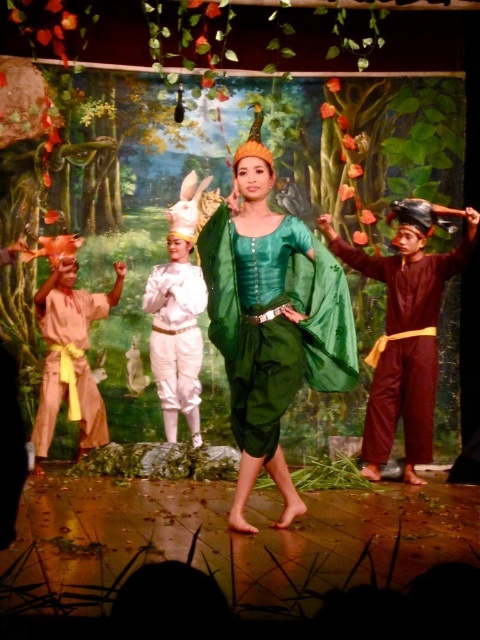
Question: Can you confirm if matte brown robe at left is positioned to the right of white satin pants at center?

Choices:
 (A) no
 (B) yes

Answer: (A)

Question: Can you confirm if matte brown robe at left is smaller than white satin pants at center?

Choices:
 (A) yes
 (B) no

Answer: (B)

Question: Is the position of brown matte pants at right more distant than that of matte brown robe at left?

Choices:
 (A) no
 (B) yes

Answer: (A)

Question: Which object appears closest to the camera in this image?

Choices:
 (A) matte brown robe at left
 (B) white satin pants at center

Answer: (A)

Question: Which of the following is the closest to the observer?

Choices:
 (A) brown matte pants at right
 (B) white satin pants at center

Answer: (A)

Question: Which object is farther from the camera taking this photo?

Choices:
 (A) white satin pants at center
 (B) matte brown robe at left
 (C) green silk dress at center

Answer: (A)